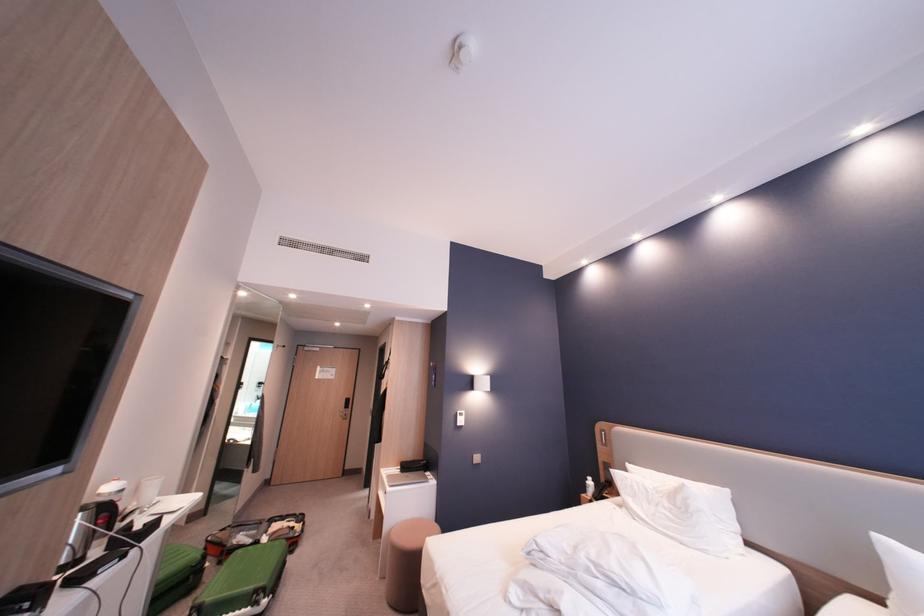
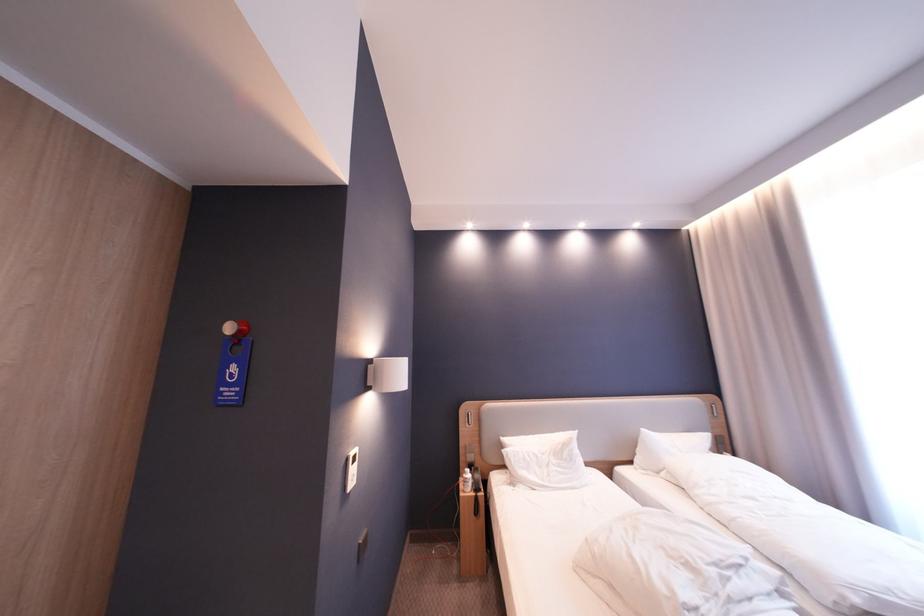
The point at (x=661, y=491) is marked in the first image. Where is the corresponding point in the second image?

(550, 456)